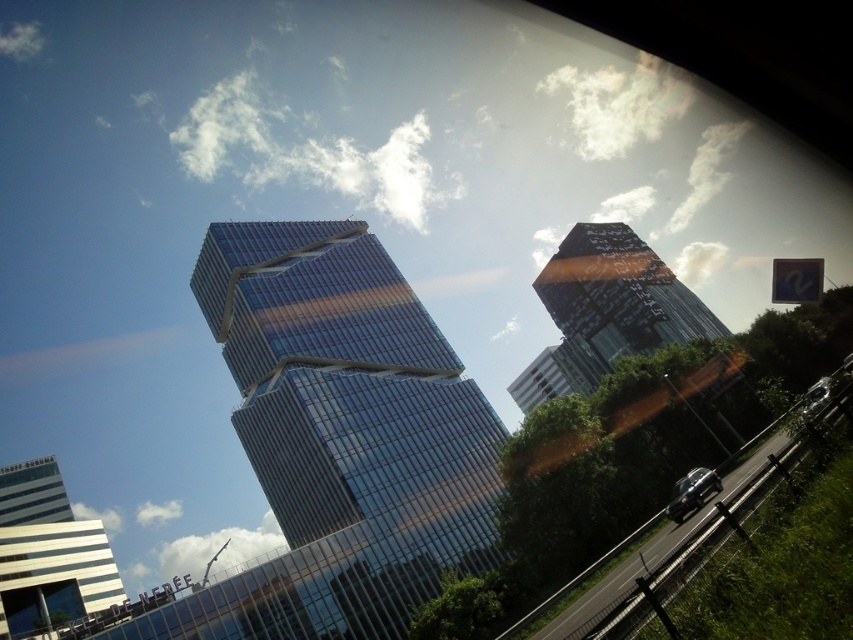
What do you see at coordinates (606, 310) in the screenshot? I see `glassy reflective building at center` at bounding box center [606, 310].

Between point (605, 285) and point (668, 509), which one is positioned in front?

Point (668, 509) is more forward.

Locate an element on the screen. Image resolution: width=853 pixels, height=640 pixels. glassy reflective building at center is located at coordinates (606, 310).

Between point (471, 436) and point (573, 605), which one is positioned in front?

Point (573, 605) is more forward.

How far apart are glassy metallic skyscraper at center and black asphalt highway at lower right?

159.07 feet

Locate an element on the screen. The width and height of the screenshot is (853, 640). glassy metallic skyscraper at center is located at coordinates (352, 410).

In order to click on glassy metallic skyscraper at center in this screenshot , I will do `click(352, 410)`.

From the picture: Can you confirm if glassy reflective building at center is positioned below white glossy building at lower left?

No, glassy reflective building at center is not below white glossy building at lower left.

Can you confirm if glassy reflective building at center is smaller than white glossy building at lower left?

No.

At what (x,y) coordinates should I click in order to perform the action: click on glassy reflective building at center. Please return your answer as a coordinate pair (x, y). The width and height of the screenshot is (853, 640). Looking at the image, I should click on (606, 310).